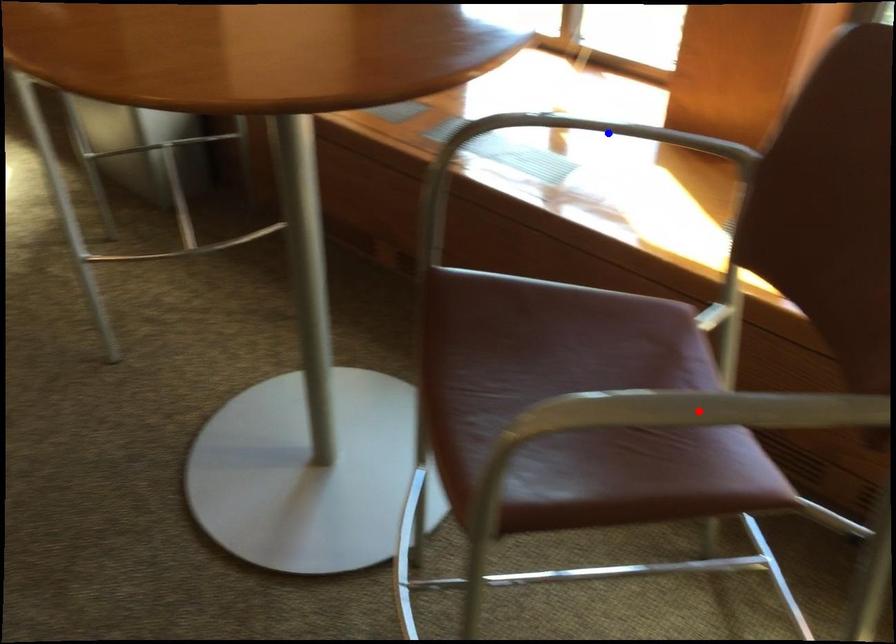
Question: Which of the two points in the image is closer to the camera?

Choices:
 (A) Blue point is closer.
 (B) Red point is closer.

Answer: (B)